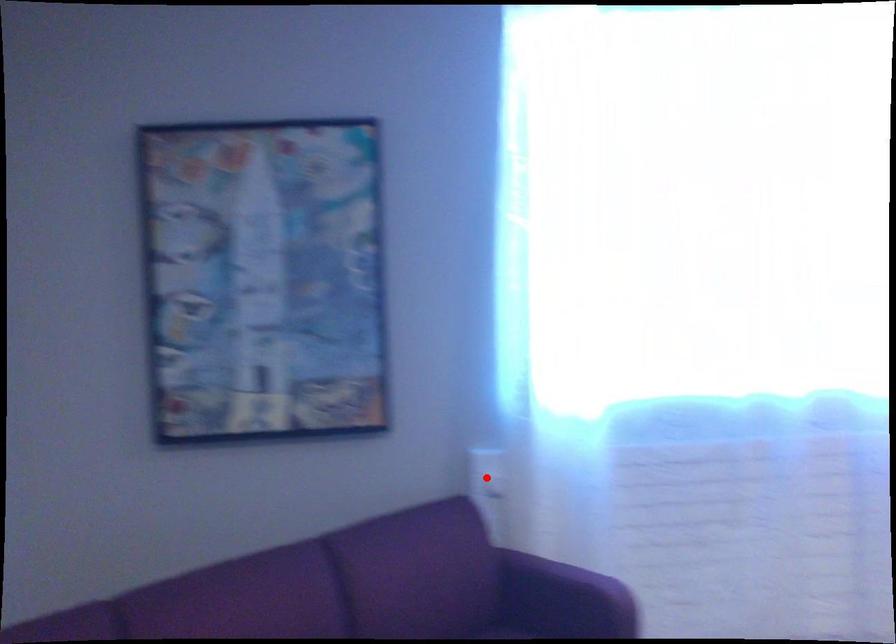
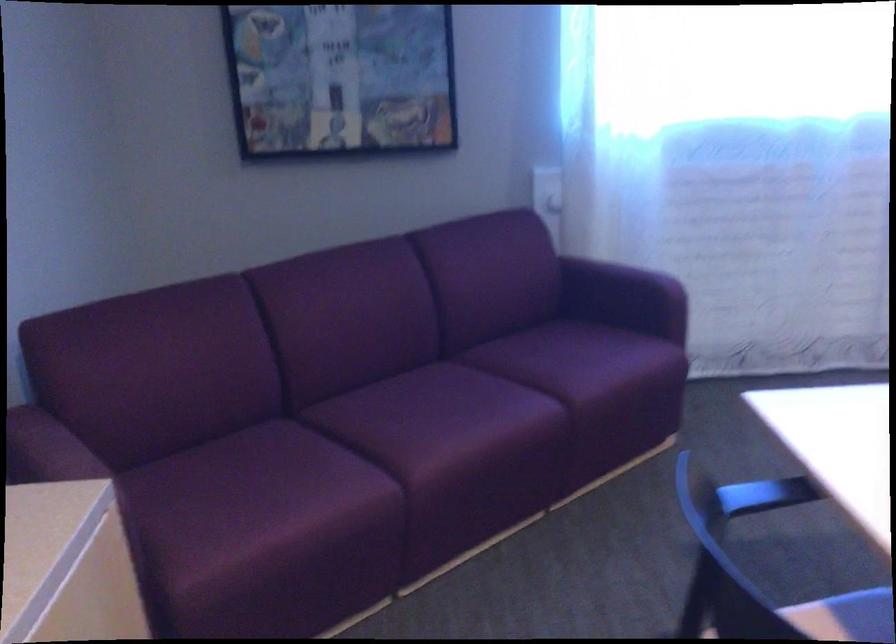
The point at the highlighted location is marked in the first image. Where is the corresponding point in the second image?

(547, 191)